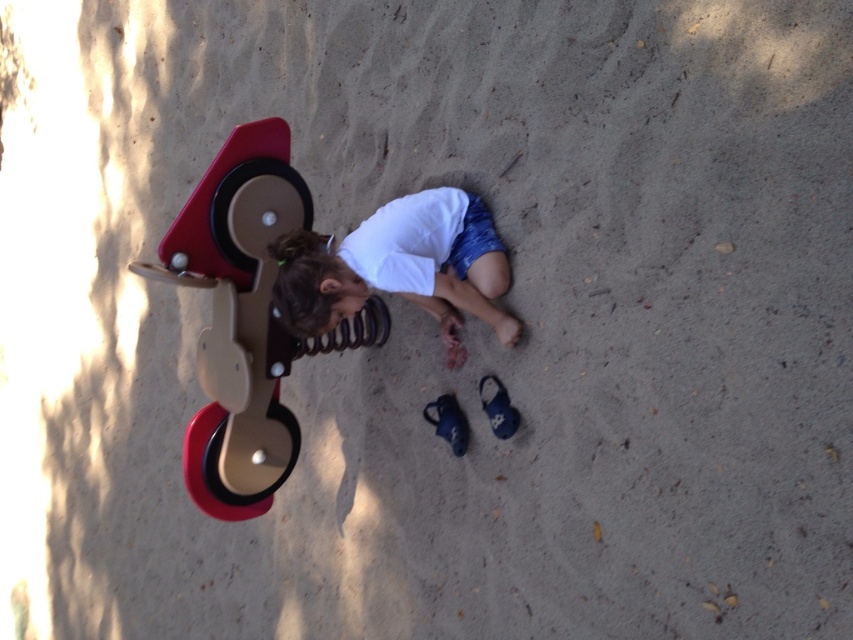
You are a photographer trying to capture a clear photo of the white cotton shirt at center and the blue suede shoe at lower center. Since the camera can only focus on one object at a time, which object should you focus on to ensure it appears sharp in the photo?

The white cotton shirt at center has a greater height compared to the blue suede shoe at lower center, so focusing on the taller object, the white cotton shirt at center, would ensure it appears sharp.

You are a parent trying to ensure your child stays safe while playing. The beige plastic swing at left and the white cotton shirt at center are both in the playground area. Which object is taller and could potentially pose a head collision risk if the child stands up?

The beige plastic swing at left is taller than the white cotton shirt at center, so it could pose a head collision risk if the child stands up.